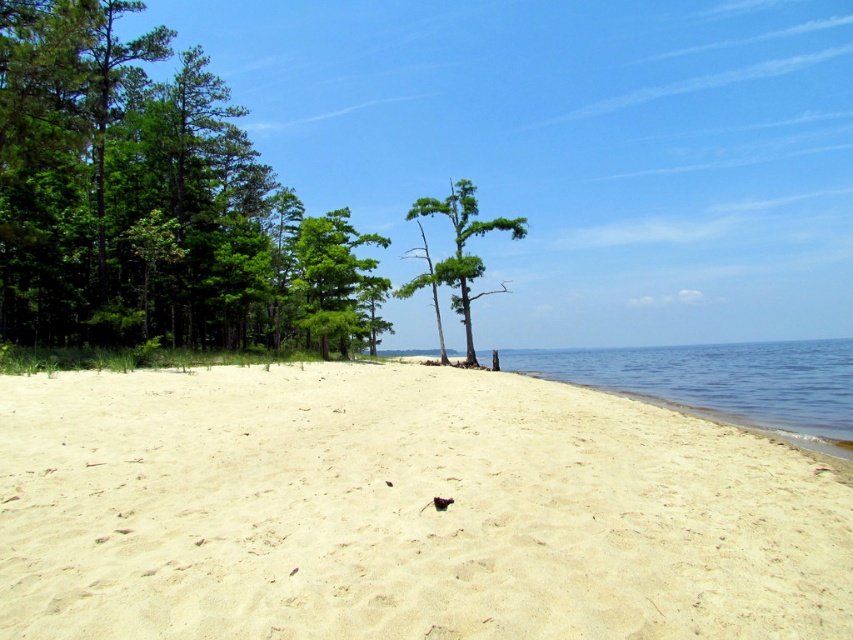
You are standing on the beach and want to walk to the clear blue water at lower right. Which direction should you move relative to the green leafy tree at center?

You should move to the right of the green leafy tree at center to reach the clear blue water at lower right.

You are standing on the beach and want to walk from the green leafy trees at left to the green leafy tree at center. Which direction should you head?

You should head to the right because the green leafy trees at left are to the left of the green leafy tree at center.

Based on the scene description, where is the white sandy beach at center located in terms of its 2D coordinates?

The white sandy beach at center is located at the 2D coordinates of point (401, 512).